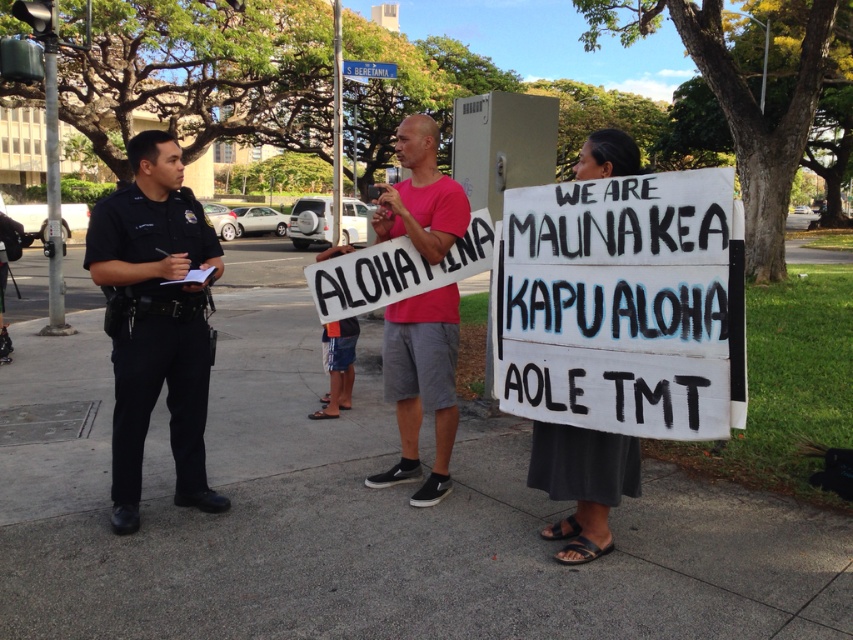
Question: Considering the real-world distances, which object is farthest from the pink fabric shirt at center?

Choices:
 (A) gray concrete pavement at center
 (B) white painted wood sign at lower right

Answer: (A)

Question: Which is farther from the dark gray fabric skirt at lower right?

Choices:
 (A) gray concrete pavement at center
 (B) white painted wood sign at lower right

Answer: (A)

Question: Does pink fabric shirt at center appear on the right side of dark gray fabric skirt at lower right?

Choices:
 (A) no
 (B) yes

Answer: (A)

Question: Which object is positioned closest to the black uniform at center?

Choices:
 (A) pink fabric shirt at center
 (B) white painted wood sign at lower right
 (C) dark gray fabric skirt at lower right

Answer: (A)

Question: Does gray concrete pavement at center have a greater width compared to white painted wood sign at lower right?

Choices:
 (A) yes
 (B) no

Answer: (A)

Question: Can you confirm if white painted wood sign at lower right is positioned to the left of black uniform at center?

Choices:
 (A) yes
 (B) no

Answer: (B)